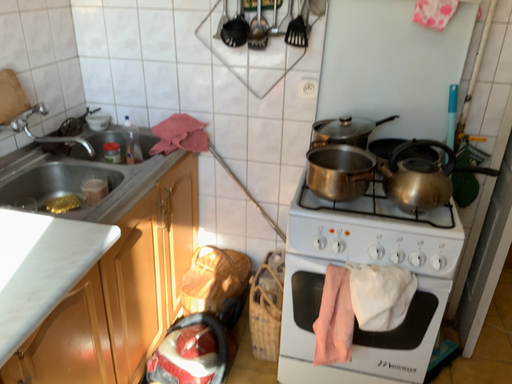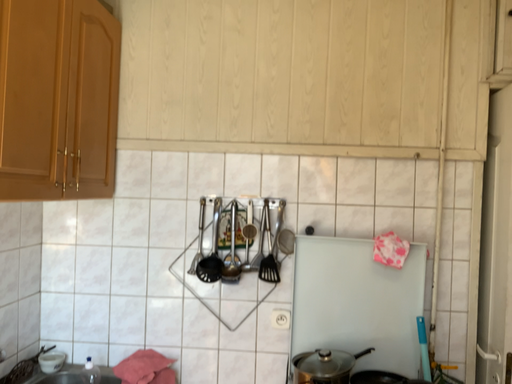
Question: Which way did the camera rotate in the video?

Choices:
 (A) rotated right
 (B) rotated left

Answer: (A)